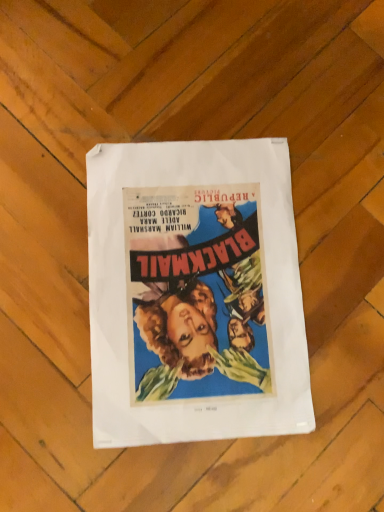
This screenshot has width=384, height=512. I want to click on vacant point above matte paper poster at center (from a real-world perspective), so (x=205, y=271).